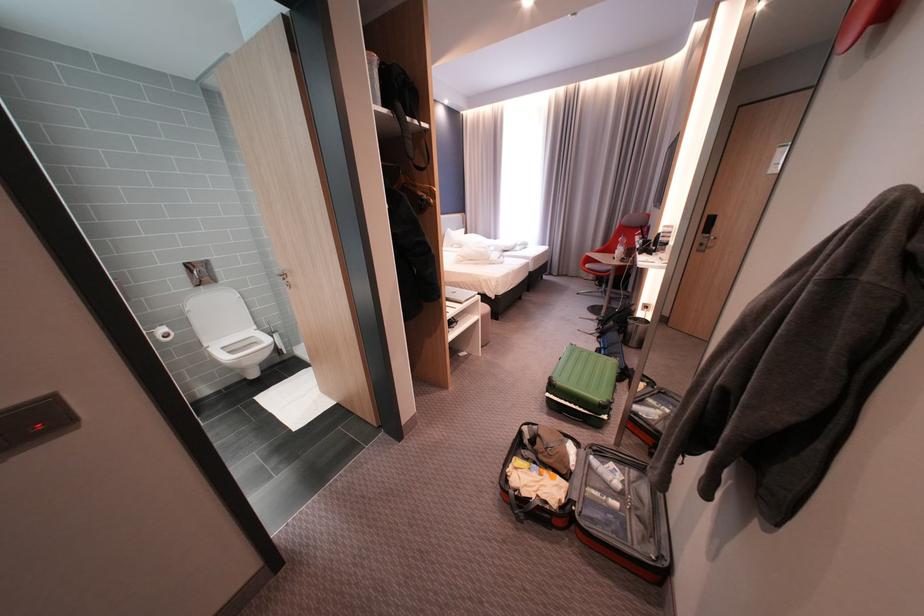
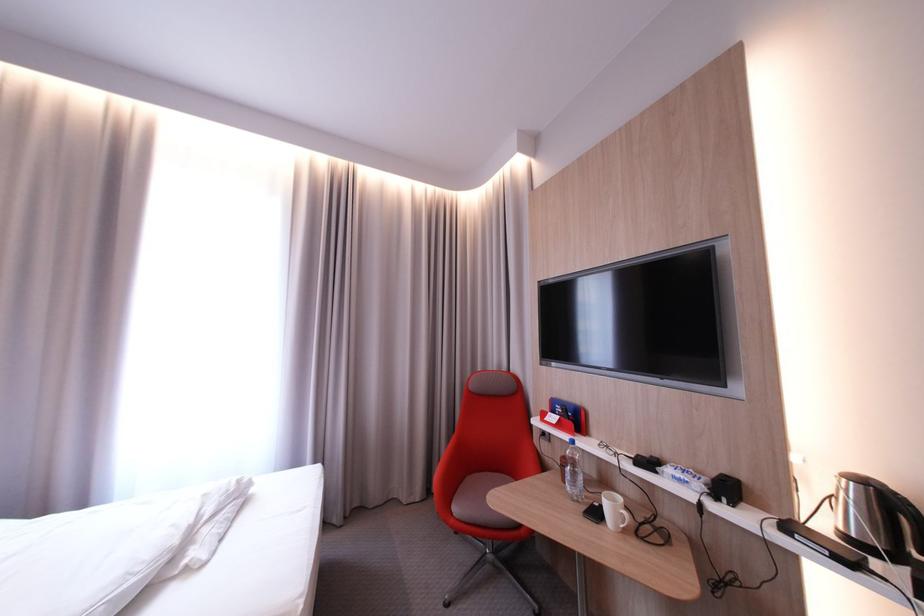
Find the pixel in the second image that matches point (598, 265) in the first image.

(467, 511)